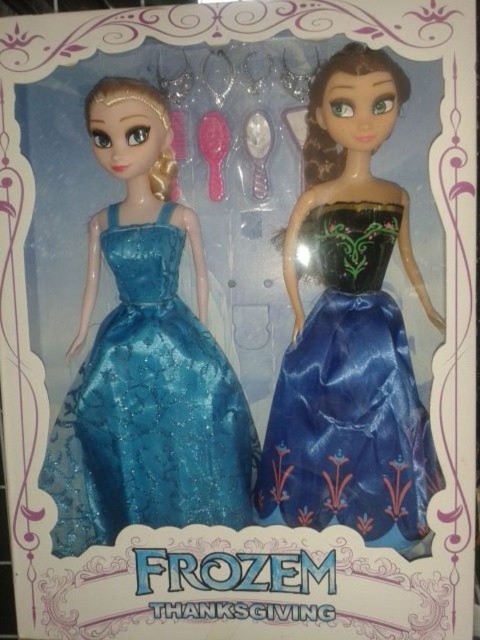
Question: Is shiny blue satin dress at left bigger than blue satin dress at right?

Choices:
 (A) yes
 (B) no

Answer: (B)

Question: Among these objects, which one is nearest to the camera?

Choices:
 (A) shiny blue satin dress at left
 (B) blue satin dress at right

Answer: (B)

Question: Does shiny blue satin dress at left appear on the right side of blue satin dress at right?

Choices:
 (A) no
 (B) yes

Answer: (A)

Question: Which point is farther from the camera taking this photo?

Choices:
 (A) (152, 330)
 (B) (351, 321)

Answer: (A)

Question: Observing the image, what is the correct spatial positioning of shiny blue satin dress at left in reference to blue satin dress at right?

Choices:
 (A) above
 (B) below

Answer: (B)

Question: Which point is farther to the camera?

Choices:
 (A) shiny blue satin dress at left
 (B) blue satin dress at right

Answer: (A)